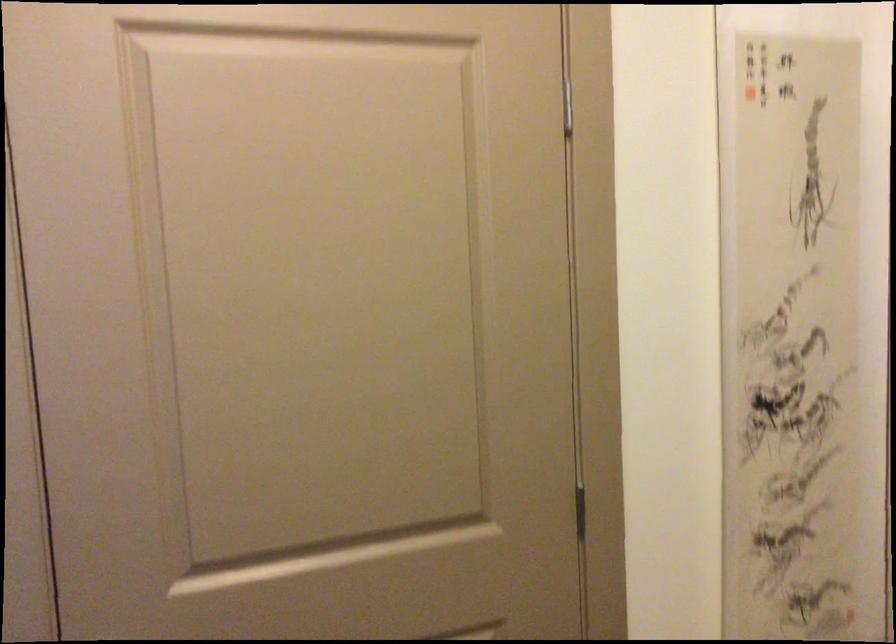
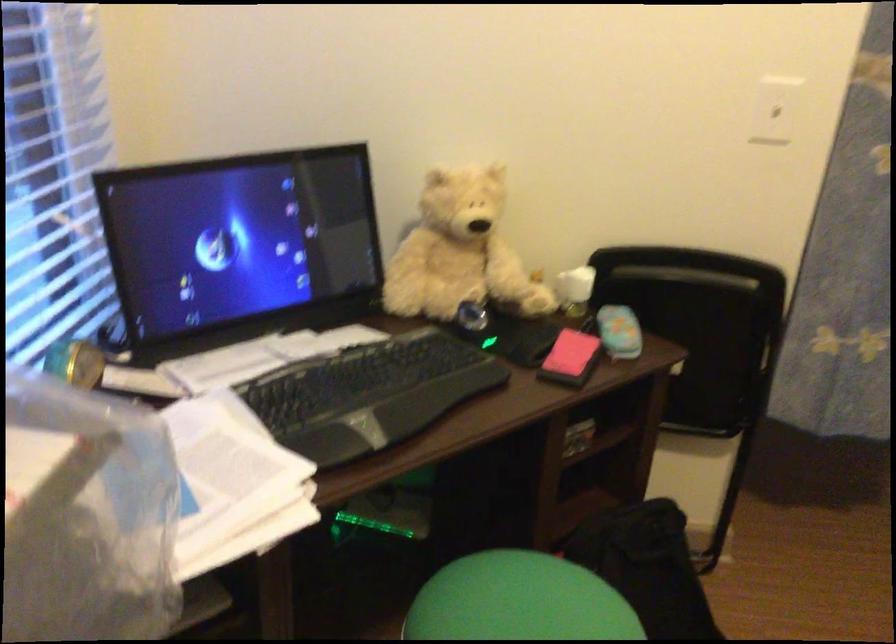
How did the camera likely rotate?

The camera's rotation is toward left-down.